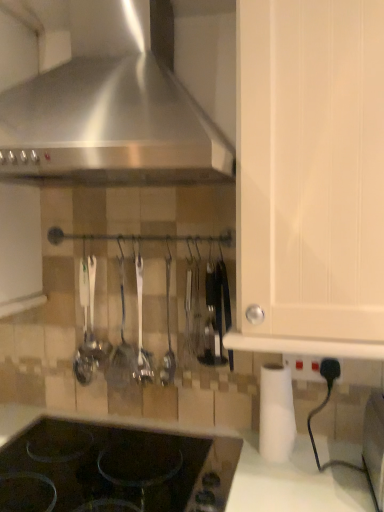
Question: Do you think white matte paper towel at lower right is within black plastic knife at center, or outside of it?

Choices:
 (A) outside
 (B) inside

Answer: (A)

Question: Is point (278, 403) positioned closer to the camera than point (192, 344)?

Choices:
 (A) closer
 (B) farther

Answer: (A)

Question: Considering the real-world distances, which object is farthest from the silver polished spoon at center, which ranks as the 2th silverware in left-to-right order?

Choices:
 (A) stainless steel range hood at upper left
 (B) white matte cabinet door at center-right
 (C) white matte paper towel at lower right
 (D) black glass gas stove at lower left
 (E) white plastic electric outlet at lower right

Answer: (B)

Question: Which object is positioned closest to the polished metal spoon at center, which ranks as the 1th silverware in left-to-right order?

Choices:
 (A) silver polished spoon at center, which ranks as the 2th silverware in left-to-right order
 (B) white plastic electric outlet at lower right
 (C) stainless steel range hood at upper left
 (D) black plastic knife at center
 (E) white matte paper towel at lower right

Answer: (A)